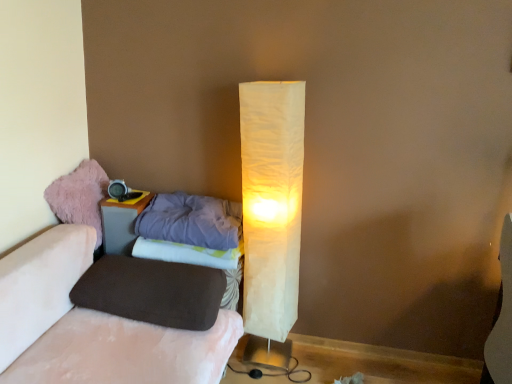
What is the approximate height of fuzzy pink bean bag at left?

It is 30.96 centimeters.

This screenshot has width=512, height=384. Describe the element at coordinates (79, 196) in the screenshot. I see `fuzzy pink bean bag at left` at that location.

What is the approximate width of matte gray nightstand at left?

matte gray nightstand at left is 10.71 inches in width.

This screenshot has height=384, width=512. Describe the element at coordinates (271, 204) in the screenshot. I see `white paper lamp at center` at that location.

Identify the location of purple soft pillow at left, marked as the first pillow in a top-to-bottom arrangement. This screenshot has height=384, width=512. (191, 220).

Find the location of `velvet pink couch at lower left`. velvet pink couch at lower left is located at coordinates (92, 325).

Is purple fabric sheet at lower center outside of white paper lamp at center?

Yes, purple fabric sheet at lower center is outside of white paper lamp at center.

Is purple fabric sheet at lower center to the left or to the right of white paper lamp at center in the image?

purple fabric sheet at lower center is positioned on white paper lamp at center's left side.

From the image's perspective, is purple fabric sheet at lower center over white paper lamp at center?

No, from the image's perspective, purple fabric sheet at lower center is not above white paper lamp at center.

Based on the photo, from the image's perspective, is purple soft pillow at left, marked as the first pillow in a top-to-bottom arrangement, over fuzzy pink bean bag at left?

Actually, purple soft pillow at left, marked as the first pillow in a top-to-bottom arrangement, appears below fuzzy pink bean bag at left in the image.

Considering the positions of objects purple soft pillow at left, which is counted as the second pillow, starting from the bottom, and fuzzy pink bean bag at left in the image provided, who is more to the left, purple soft pillow at left, which is counted as the second pillow, starting from the bottom, or fuzzy pink bean bag at left?

Positioned to the left is fuzzy pink bean bag at left.

Between point (198, 226) and point (104, 172), which one is positioned behind?

The point (104, 172) is behind.

Are purple soft pillow at left, which is counted as the second pillow, starting from the bottom, and fuzzy pink bean bag at left making contact?

No, purple soft pillow at left, which is counted as the second pillow, starting from the bottom, is not making contact with fuzzy pink bean bag at left.

Can you confirm if fuzzy pink bean bag at left is positioned to the left of white paper lamp at center?

Indeed, fuzzy pink bean bag at left is positioned on the left side of white paper lamp at center.

Is fuzzy pink bean bag at left oriented away from white paper lamp at center?

No, fuzzy pink bean bag at left is not facing the opposite direction of white paper lamp at center.

Between fuzzy pink bean bag at left and white paper lamp at center, which one has larger width?

Wider between the two is fuzzy pink bean bag at left.

Is fuzzy pink bean bag at left to the right of velvet pink couch at lower left from the viewer's perspective?

No.

Is fuzzy pink bean bag at left outside of velvet pink couch at lower left?

Absolutely, fuzzy pink bean bag at left is external to velvet pink couch at lower left.

The width and height of the screenshot is (512, 384). What are the coordinates of `furniture in front of the fuzzy pink bean bag at left` in the screenshot? It's located at (92, 325).

From the image's perspective, is fuzzy pink bean bag at left under velvet pink couch at lower left?

Actually, fuzzy pink bean bag at left appears above velvet pink couch at lower left in the image.

Can you see matte gray nightstand at left touching purple soft pillow at left, which is counted as the second pillow, starting from the bottom?

No, matte gray nightstand at left is not touching purple soft pillow at left, which is counted as the second pillow, starting from the bottom.

Locate an element on the screen. The height and width of the screenshot is (384, 512). nightstand that is under the purple soft pillow at left, marked as the first pillow in a top-to-bottom arrangement (from a real-world perspective) is located at coordinates (121, 222).

How different are the orientations of matte gray nightstand at left and purple soft pillow at left, marked as the first pillow in a top-to-bottom arrangement, in degrees?

The angular difference between matte gray nightstand at left and purple soft pillow at left, marked as the first pillow in a top-to-bottom arrangement, is 6.69e-05 degrees.

Considering the sizes of objects matte gray nightstand at left and purple soft pillow at left, which is counted as the second pillow, starting from the bottom, in the image provided, who is thinner, matte gray nightstand at left or purple soft pillow at left, which is counted as the second pillow, starting from the bottom,?

matte gray nightstand at left.

Would you say fuzzy pink bean bag at left is outside brown fabric pillow at lower left, the second pillow from the top?

That's correct, fuzzy pink bean bag at left is outside of brown fabric pillow at lower left, the second pillow from the top.

Is brown fabric pillow at lower left, the second pillow from the top, at the back of fuzzy pink bean bag at left?

No, brown fabric pillow at lower left, the second pillow from the top, is not at the back of fuzzy pink bean bag at left.

From the image's perspective, which pillow is the 2nd one below the fuzzy pink bean bag at left? Please provide its 2D coordinates.

[(152, 291)]

Is white paper lamp at center to the left of purple fabric sheet at lower center from the viewer's perspective?

No.

Could you tell me if white paper lamp at center is facing purple fabric sheet at lower center?

No, white paper lamp at center is not turned towards purple fabric sheet at lower center.

Is white paper lamp at center bigger or smaller than purple fabric sheet at lower center?

In the image, white paper lamp at center appears to be larger than purple fabric sheet at lower center.

Which point is more distant from viewer, (262, 170) or (188, 261)?

The point (188, 261) is more distant.

At what (x,y) coordinates should I click in order to perform the action: click on lamp that appears in front of the purple fabric sheet at lower center. Please return your answer as a coordinate pair (x, y). Looking at the image, I should click on (271, 204).

Find the location of a particular element. This screenshot has width=512, height=384. pillow that is the 1st object located below the fuzzy pink bean bag at left (from the image's perspective) is located at coordinates (191, 220).

Estimate the real-world distances between objects in this image. Which object is further from white paper lamp at center, matte gray nightstand at left or velvet pink couch at lower left?

Among the two, matte gray nightstand at left is located further to white paper lamp at center.

Based on the photo, based on their spatial positions, is purple fabric sheet at lower center or brown fabric pillow at lower left, the second pillow from the top, further from white paper lamp at center?

brown fabric pillow at lower left, the second pillow from the top, is positioned further to the anchor white paper lamp at center.

Looking at the image, which one is located further to brown fabric pillow at lower left, the second pillow from the top, fuzzy pink bean bag at left or matte gray nightstand at left?

fuzzy pink bean bag at left.

In the scene shown: Considering their positions, is purple soft pillow at left, marked as the first pillow in a top-to-bottom arrangement, positioned closer to matte gray nightstand at left than purple fabric sheet at lower center?

The object closer to matte gray nightstand at left is purple fabric sheet at lower center.

Based on their spatial positions, is purple soft pillow at left, marked as the first pillow in a top-to-bottom arrangement, or brown fabric pillow at lower left, which is counted as the 1th pillow, starting from the bottom, further from fuzzy pink bean bag at left?

The object further to fuzzy pink bean bag at left is brown fabric pillow at lower left, which is counted as the 1th pillow, starting from the bottom.

Which object lies nearer to the anchor point white paper lamp at center, matte gray nightstand at left or purple soft pillow at left, which is counted as the second pillow, starting from the bottom?

The object closer to white paper lamp at center is purple soft pillow at left, which is counted as the second pillow, starting from the bottom.

When comparing their distances from white paper lamp at center, does fuzzy pink bean bag at left or matte gray nightstand at left seem further?

fuzzy pink bean bag at left lies further to white paper lamp at center than the other object.

Estimate the real-world distances between objects in this image. Which object is closer to white paper lamp at center, brown fabric pillow at lower left, the second pillow from the top, or matte gray nightstand at left?

brown fabric pillow at lower left, the second pillow from the top.

You are a GUI agent. You are given a task and a screenshot of the screen. Output one action in this format:
    pyautogui.click(x=<x>, y=<y>)
    Task: Click on the pillow situated between brown fabric pillow at lower left, the second pillow from the top, and white paper lamp at center from left to right
    
    Given the screenshot: What is the action you would take?
    pyautogui.click(x=191, y=220)

This screenshot has width=512, height=384. I want to click on pillow between fuzzy pink bean bag at left and purple fabric sheet at lower center in the horizontal direction, so click(x=152, y=291).

The width and height of the screenshot is (512, 384). Find the location of `sheet between matte gray nightstand at left and white paper lamp at center in the horizontal direction`. sheet between matte gray nightstand at left and white paper lamp at center in the horizontal direction is located at coordinates (187, 253).

This screenshot has height=384, width=512. In order to click on sheet positioned between brown fabric pillow at lower left, which is counted as the 1th pillow, starting from the bottom, and matte gray nightstand at left from near to far in this screenshot , I will do `click(187, 253)`.